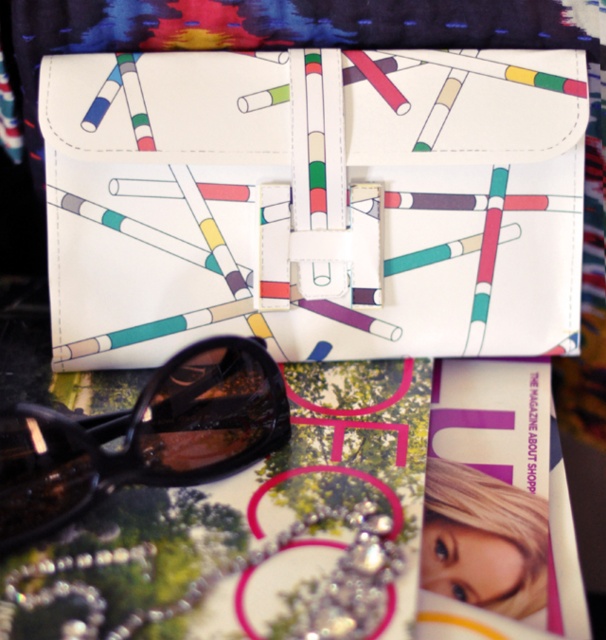
Between point (442, 275) and point (130, 483), which one is positioned behind?

The point (442, 275) is more distant.

Does point (376, 342) come farther from viewer compared to point (152, 445)?

Yes, point (376, 342) is behind point (152, 445).

The height and width of the screenshot is (640, 606). I want to click on white leather clutch at center, so click(x=315, y=204).